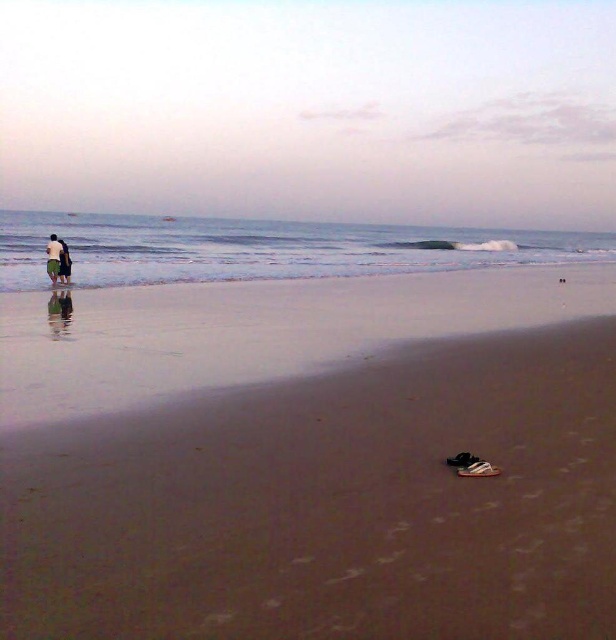
Question: Is blue water at upper center thinner than white cotton shirt at left?

Choices:
 (A) no
 (B) yes

Answer: (A)

Question: Is brown sand at lower center positioned in front of dark green shorts at left?

Choices:
 (A) no
 (B) yes

Answer: (B)

Question: Which object is positioned farthest from the brown sand at lower center?

Choices:
 (A) white cotton shirt at left
 (B) dark green shorts at left

Answer: (A)

Question: Among these points, which one is nearest to the camera?

Choices:
 (A) (49, 269)
 (B) (2, 371)
 (C) (59, 262)

Answer: (B)

Question: Which object appears closest to the camera in this image?

Choices:
 (A) dark green shorts at left
 (B) brown sand at lower center
 (C) white cotton shirt at left
 (D) blue water at upper center

Answer: (B)

Question: Can you confirm if blue water at upper center is thinner than dark green shorts at left?

Choices:
 (A) no
 (B) yes

Answer: (A)